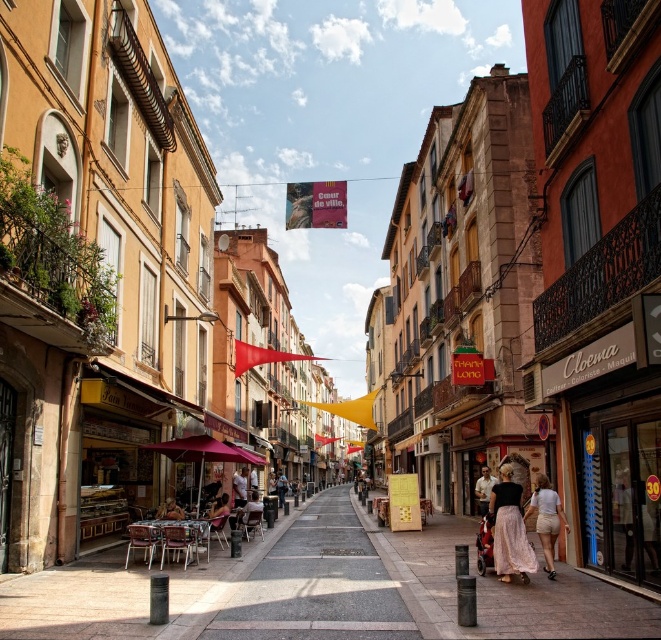
Question: Can you confirm if gray concrete pavement at center is positioned below light brown leather chair at center?

Choices:
 (A) no
 (B) yes

Answer: (B)

Question: Is light brown wooden chair at center above brown leather jacket at center?

Choices:
 (A) no
 (B) yes

Answer: (B)

Question: Which of these objects is positioned closest to the light brown leather jacket at center?

Choices:
 (A) gray concrete pavement at center
 (B) white cotton shorts at lower right
 (C) light pink fabric skirt at center

Answer: (B)

Question: Is pink fabric umbrella at center behind brown leather jacket at center?

Choices:
 (A) yes
 (B) no

Answer: (A)

Question: Which of the following is the closest to the observer?

Choices:
 (A) light pink fabric skirt at center
 (B) light brown wooden chair at center

Answer: (A)

Question: Which point is farther from the camera taking this photo?

Choices:
 (A) (533, 499)
 (B) (233, 499)
 (C) (488, 499)

Answer: (B)